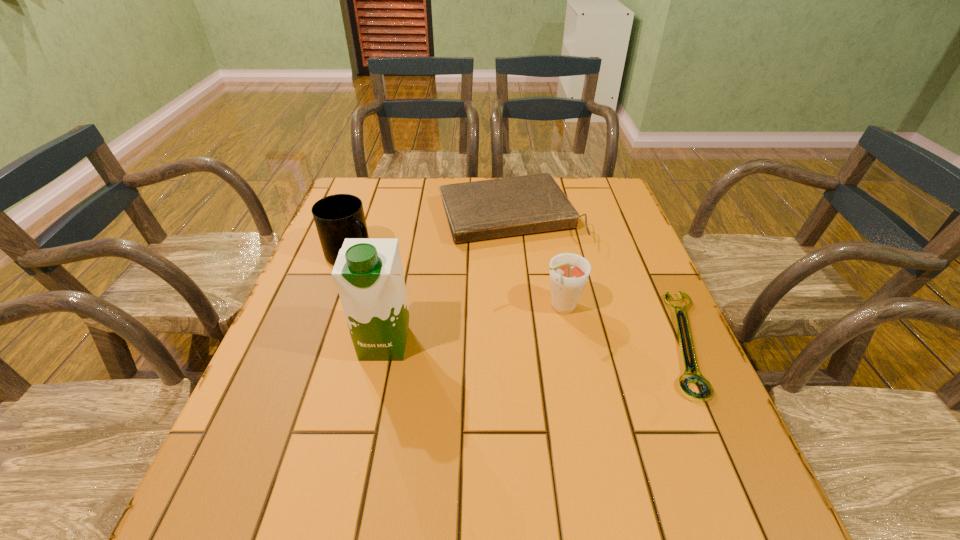
The image size is (960, 540). Identify the location of vacant space on the desktop that is between the tallest object and the wrench and is positioned on the side of the mug with the handle. (492, 343).

I want to click on free space on the desktop that is between the second object from left to right and the shortest object and is positioned on the spine side of the paperback book, so click(x=574, y=342).

This screenshot has height=540, width=960. In order to click on free space on the desktop that is between the tallest object and the shortest object and is positioned on the drink side of the root beer in this screenshot , I will do (x=492, y=343).